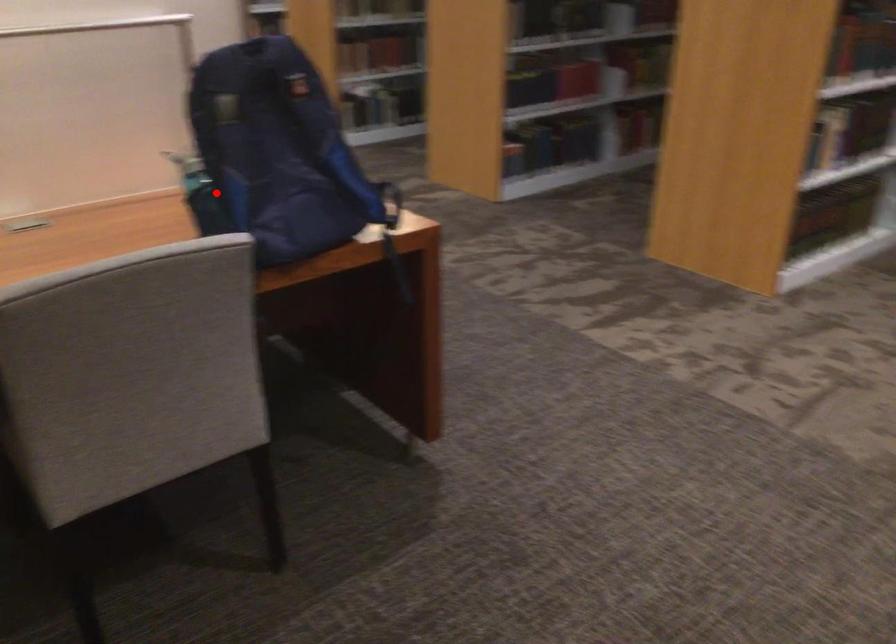
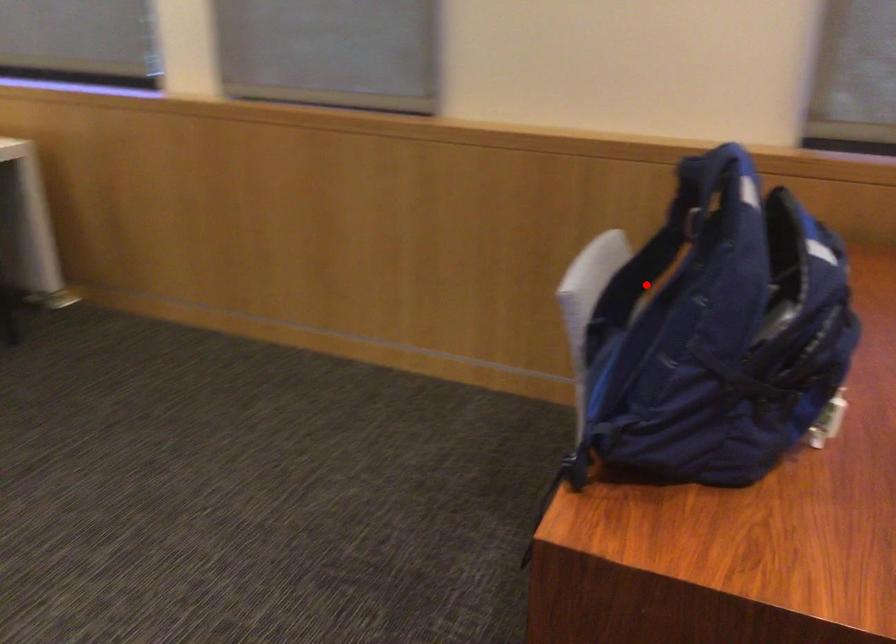
I am providing you with two images of the same scene from different viewpoints. A red point is marked on the first image and another point is marked on the second image. Is the marked point in image1 the same physical position as the marked point in image2?

Yes